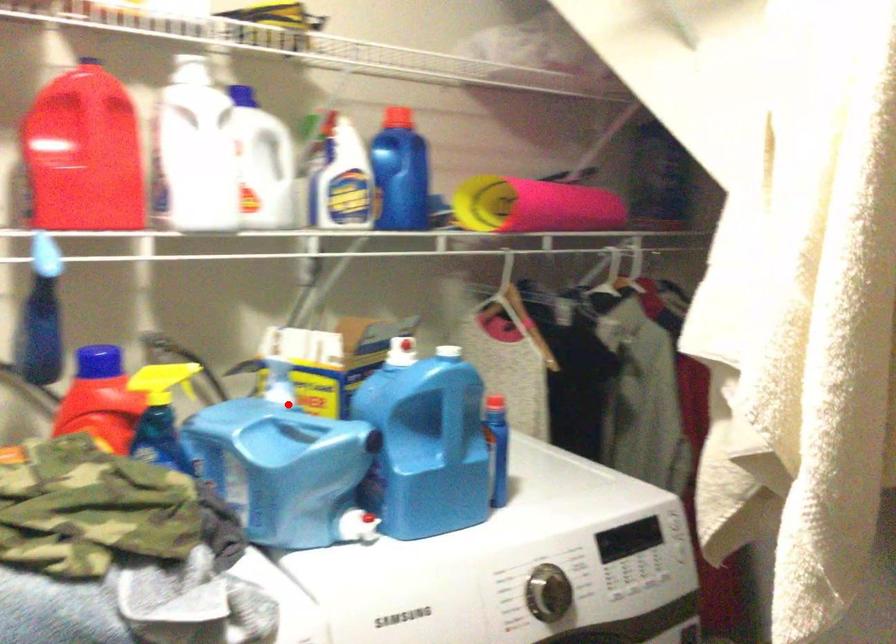
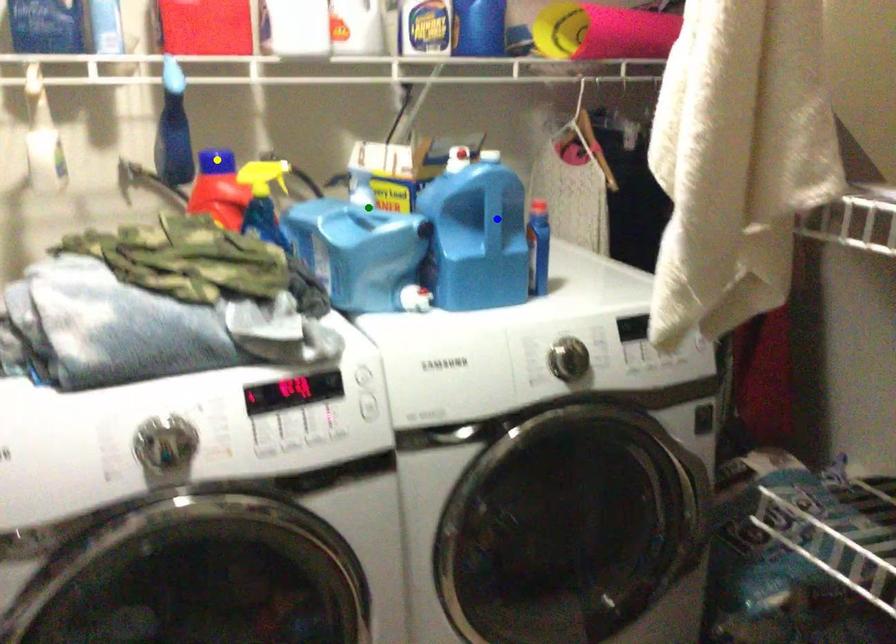
Question: I am providing you with two images of the same scene from different viewpoints. A red point is marked on the first image. You are given multiple points on the second image. Which point in image 2 is actually the same real-world point as the red point in image 1?

Choices:
 (A) yellow point
 (B) blue point
 (C) green point

Answer: (C)